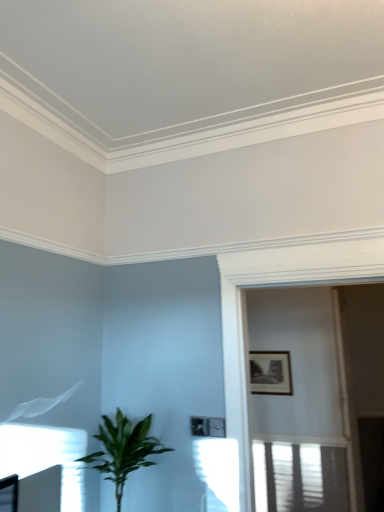
Question: From the image's perspective, is white glossy screen door at upper center above green leafy plant at lower left?

Choices:
 (A) no
 (B) yes

Answer: (B)

Question: Does white glossy screen door at upper center have a larger size compared to green leafy plant at lower left?

Choices:
 (A) no
 (B) yes

Answer: (B)

Question: Is white glossy screen door at upper center surrounding green leafy plant at lower left?

Choices:
 (A) yes
 (B) no

Answer: (B)

Question: From the image's perspective, is white glossy screen door at upper center below green leafy plant at lower left?

Choices:
 (A) no
 (B) yes

Answer: (A)

Question: Does white glossy screen door at upper center have a lesser width compared to green leafy plant at lower left?

Choices:
 (A) yes
 (B) no

Answer: (A)

Question: Can you confirm if white glossy screen door at upper center is taller than green leafy plant at lower left?

Choices:
 (A) yes
 (B) no

Answer: (A)

Question: Can you confirm if black matte picture frame at upper right is positioned to the left of green leafy plant at lower left?

Choices:
 (A) yes
 (B) no

Answer: (B)

Question: Could you tell me if black matte picture frame at upper right is turned towards green leafy plant at lower left?

Choices:
 (A) no
 (B) yes

Answer: (B)

Question: Can you confirm if black matte picture frame at upper right is thinner than green leafy plant at lower left?

Choices:
 (A) yes
 (B) no

Answer: (A)

Question: Does black matte picture frame at upper right appear on the right side of green leafy plant at lower left?

Choices:
 (A) no
 (B) yes

Answer: (B)

Question: From the image's perspective, is black matte picture frame at upper right beneath green leafy plant at lower left?

Choices:
 (A) yes
 (B) no

Answer: (B)

Question: Considering the relative positions of black matte picture frame at upper right and green leafy plant at lower left in the image provided, is black matte picture frame at upper right in front of green leafy plant at lower left?

Choices:
 (A) yes
 (B) no

Answer: (B)

Question: From a real-world perspective, is white glossy screen door at upper center on black matte picture frame at upper right?

Choices:
 (A) no
 (B) yes

Answer: (B)